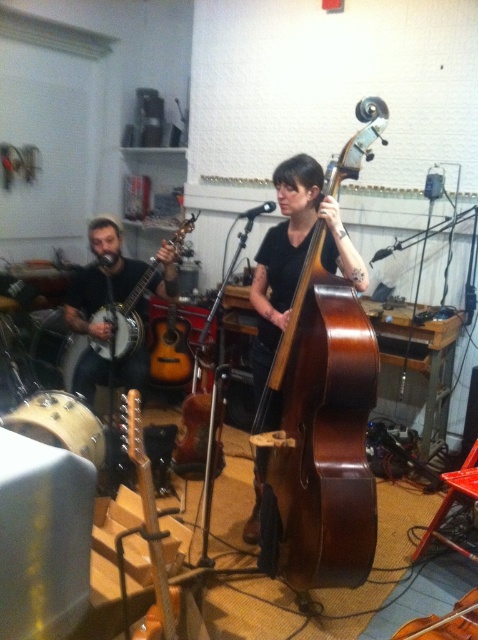
Question: Can you confirm if matte black banjo at left is smaller than brown wooden cello at center?

Choices:
 (A) no
 (B) yes

Answer: (A)

Question: Among these points, which one is nearest to the camera?

Choices:
 (A) (457, 630)
 (B) (132, 353)
 (C) (312, 320)

Answer: (A)

Question: Which is nearer to the matte black banjo at left?

Choices:
 (A) brown wooden cello at center
 (B) brown polished wood cello at center

Answer: (B)

Question: Is brown polished wood cello at center positioned before brown wooden cello at center?

Choices:
 (A) yes
 (B) no

Answer: (B)

Question: Is brown polished wood cello at center below brown wooden cello at center?

Choices:
 (A) yes
 (B) no

Answer: (B)

Question: Which is farther from the matte black banjo at left?

Choices:
 (A) brown polished wood cello at center
 (B) brown wooden cello at center

Answer: (B)